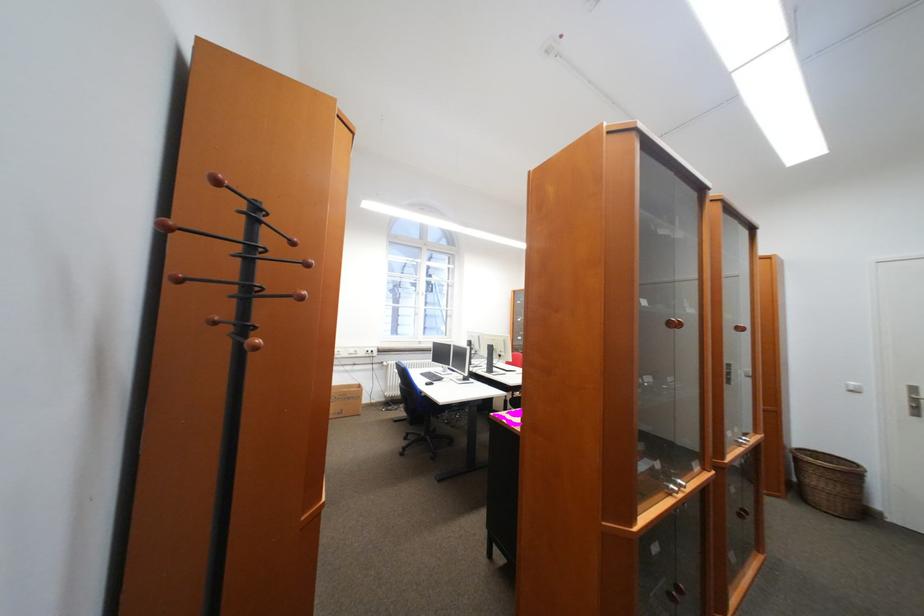
What do you see at coordinates (419, 442) in the screenshot? I see `the chair sitting surface` at bounding box center [419, 442].